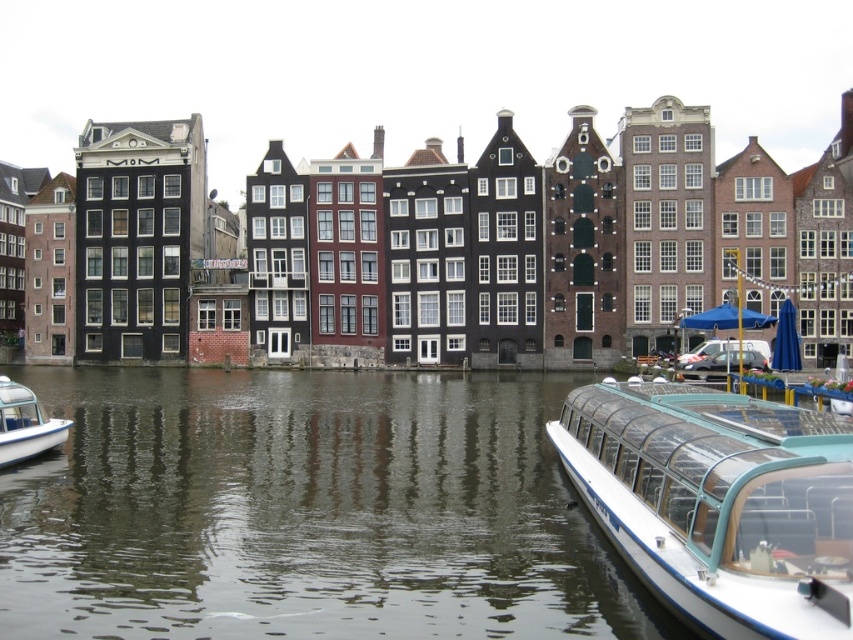
Does white glossy boat at lower right have a greater height compared to white glossy boat at lower left?

Indeed, white glossy boat at lower right has a greater height compared to white glossy boat at lower left.

The image size is (853, 640). Identify the location of white glossy boat at lower right. (718, 502).

Is point (364, 602) behind point (20, 424)?

No, it is not.

Between point (172, 422) and point (32, 394), which one is positioned behind?

The point (172, 422) is more distant.

Where is `smooth water at center`? smooth water at center is located at coordinates (306, 512).

Consider the image. Can you confirm if smooth water at center is positioned to the right of white glossy boat at lower right?

In fact, smooth water at center is to the left of white glossy boat at lower right.

Who is positioned more to the right, smooth water at center or white glossy boat at lower right?

From the viewer's perspective, white glossy boat at lower right appears more on the right side.

Is point (279, 428) positioned in front of point (755, 445)?

No, (279, 428) is behind (755, 445).

You are a GUI agent. You are given a task and a screenshot of the screen. Output one action in this format:
    pyautogui.click(x=<x>, y=<y>)
    Task: Click on the smooth water at center
    Image resolution: width=853 pixels, height=640 pixels.
    Given the screenshot: What is the action you would take?
    pyautogui.click(x=306, y=512)